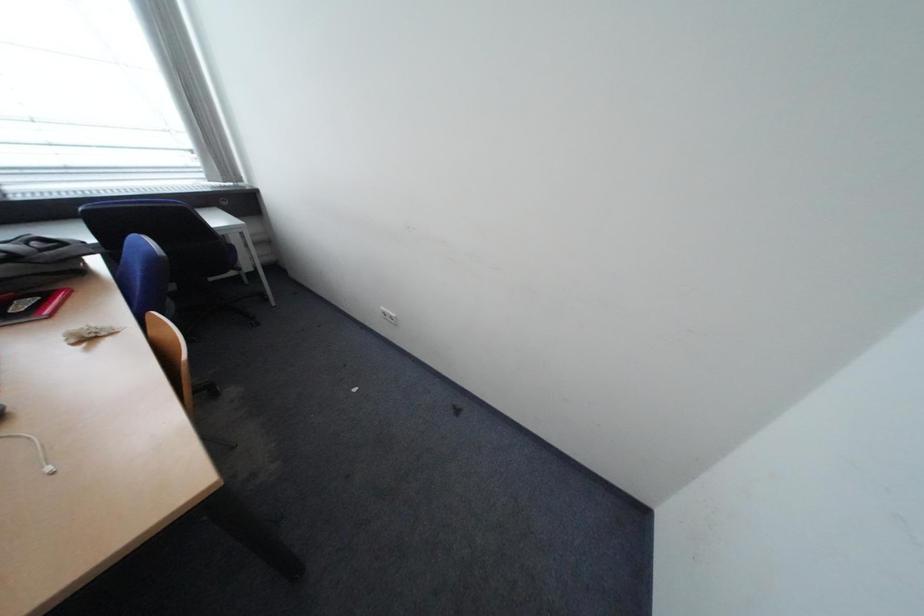
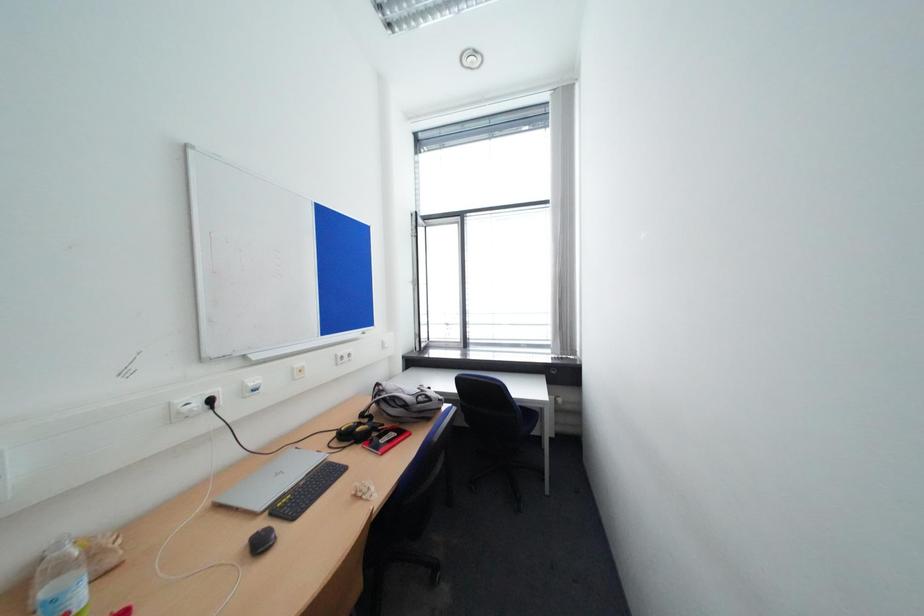
Question: The images are taken continuously from a first-person perspective. In which direction is your viewpoint rotating?

Choices:
 (A) Left
 (B) Right
 (C) Up
 (D) Down

Answer: (A)